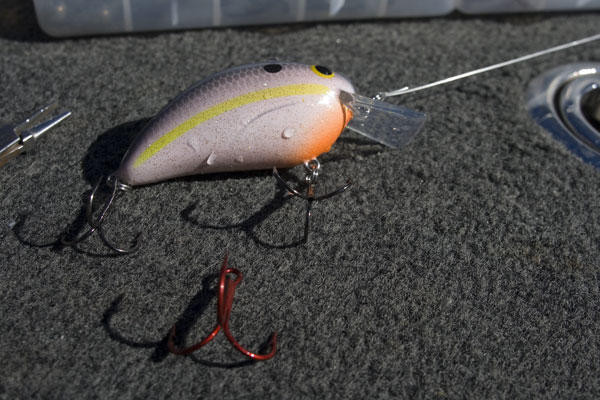
In order to click on rightmost hook in this screenshot , I will do `click(310, 196)`.